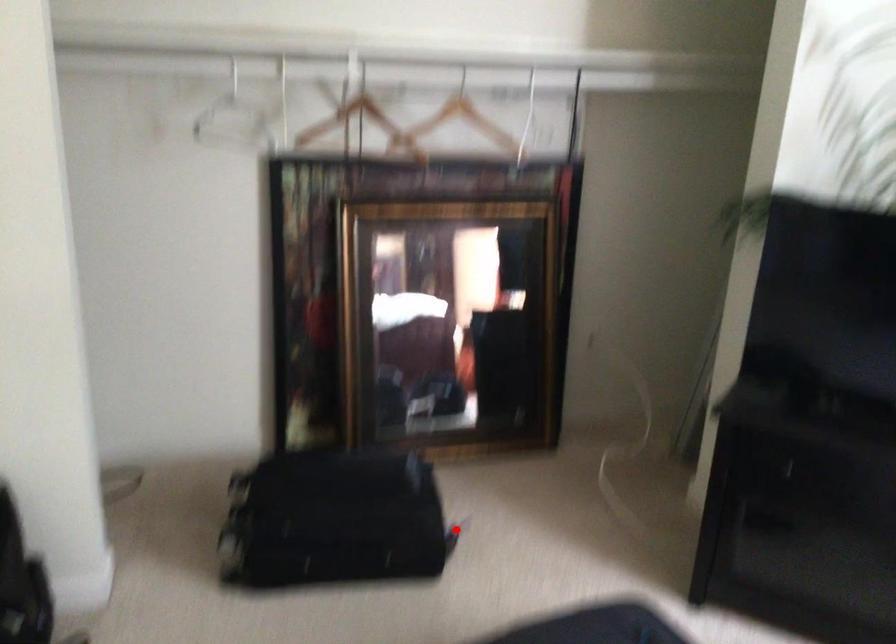
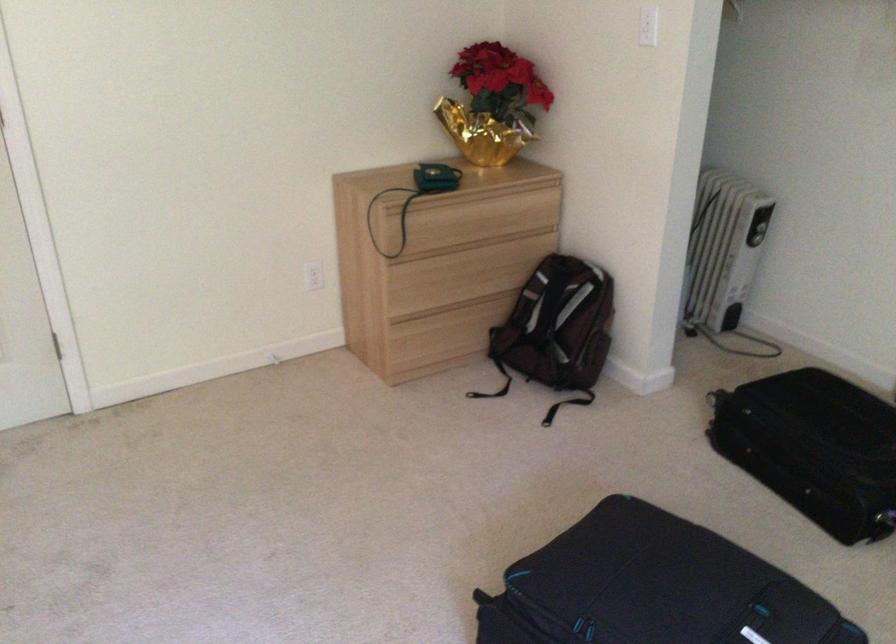
Locate, in the second image, the point that corresponds to the highlighted location in the first image.

(883, 509)